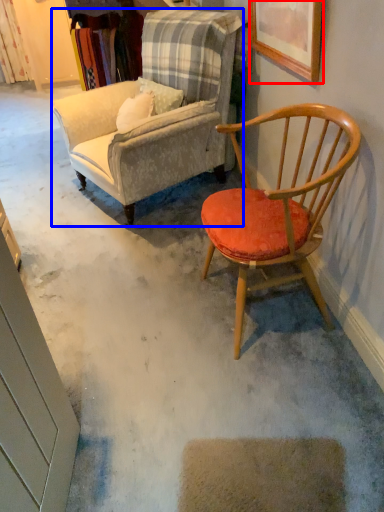
Question: Which object appears closest to the camera in this image, picture frame (highlighted by a red box) or chair (highlighted by a blue box)?

Choices:
 (A) picture frame
 (B) chair

Answer: (A)